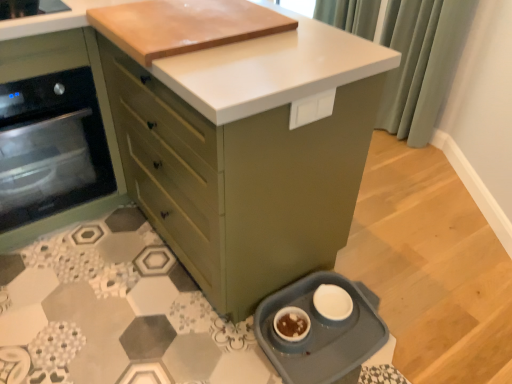
This screenshot has height=384, width=512. Find the location of `free area in between matte green cabinet at center, arranged as the second cabinetry when viewed from the left, and blue plastic pet dish at lower right`. free area in between matte green cabinet at center, arranged as the second cabinetry when viewed from the left, and blue plastic pet dish at lower right is located at coordinates (260, 358).